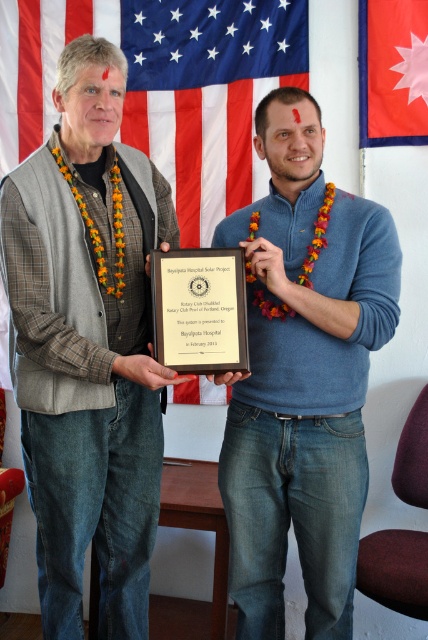
Does blue matte sweater at center appear over matte black plaque at center?

Actually, blue matte sweater at center is below matte black plaque at center.

Which of these two, blue matte sweater at center or matte black plaque at center, stands taller?

Standing taller between the two is blue matte sweater at center.

The image size is (428, 640). What are the coordinates of `blue matte sweater at center` in the screenshot? It's located at (303, 378).

The image size is (428, 640). I want to click on blue matte sweater at center, so [x=303, y=378].

Does blue matte sweater at center lie in front of american flag at upper center?

Yes, it is.

Who is more distant from viewer, (324,288) or (8,104)?

Positioned behind is point (8,104).

Is point (258, 605) closer to camera compared to point (38, 92)?

Yes, it is.

What are the coordinates of `blue matte sweater at center` in the screenshot? It's located at (303, 378).

Between matte gray vest at center and blue matte sweater at center, which one has less height?

blue matte sweater at center

Consider the image. Does matte gray vest at center have a greater height compared to blue matte sweater at center?

Yes, matte gray vest at center is taller than blue matte sweater at center.

Is point (121, 371) closer to viewer compared to point (333, 614)?

Yes, point (121, 371) is closer to viewer.

The image size is (428, 640). Identify the location of matte gray vest at center. (88, 362).